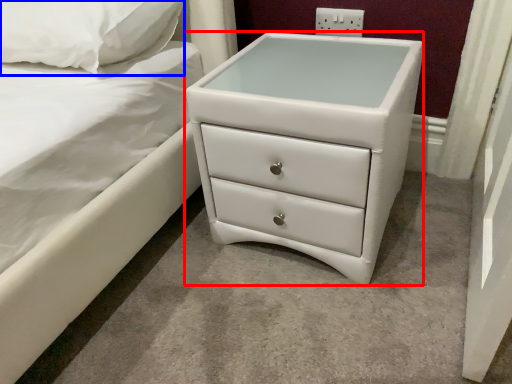
Question: Which point is closer to the camera, chest of drawers (highlighted by a red box) or pillow (highlighted by a blue box)?

Choices:
 (A) chest of drawers
 (B) pillow

Answer: (A)